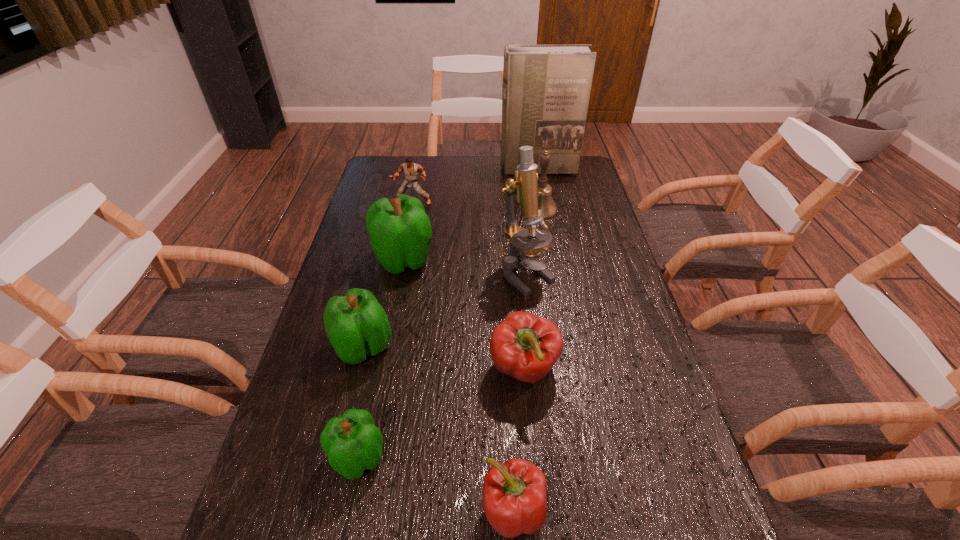
The image size is (960, 540). I want to click on object that is the fifth closest one to the bell, so [524, 346].

Choose which bell pepper is the third nearest neighbor to the nearest green bell pepper. Please provide its 2D coordinates. Your answer should be formatted as a tuple, i.e. [(x, y)], where the tuple contains the x and y coordinates of a point satisfying the conditions above.

[(524, 346)]

Point out which bell pepper is positioned as the nearest to the second smallest green bell pepper. Please provide its 2D coordinates. Your answer should be formatted as a tuple, i.e. [(x, y)], where the tuple contains the x and y coordinates of a point satisfying the conditions above.

[(352, 442)]

The height and width of the screenshot is (540, 960). Identify the location of the closest green bell pepper relative to the bigger pink bell pepper. (352, 442).

Identify the location of green bell pepper identified as the second closest to the farthest object. The width and height of the screenshot is (960, 540). 356,324.

At what (x,y) coordinates should I click in order to perform the action: click on blank area in the image that satisfies the following two spatial constraints: 1. on the back side of the nearest green bell pepper; 2. on the left side of the microscope. Please return your answer as a coordinate pair (x, y). This screenshot has width=960, height=540. Looking at the image, I should click on (396, 275).

Find the location of `free point that satisfies the following two spatial constraints: 1. on the back side of the microscope; 2. on the right side of the second smallest green bell pepper`. free point that satisfies the following two spatial constraints: 1. on the back side of the microscope; 2. on the right side of the second smallest green bell pepper is located at coordinates (380, 275).

Where is `blank space that satisfies the following two spatial constraints: 1. on the back side of the second farthest green bell pepper; 2. on the left side of the bell`? The width and height of the screenshot is (960, 540). blank space that satisfies the following two spatial constraints: 1. on the back side of the second farthest green bell pepper; 2. on the left side of the bell is located at coordinates (396, 210).

What are the coordinates of `vacant space that satisfies the following two spatial constraints: 1. on the back side of the microscope; 2. on the right side of the smallest green bell pepper` in the screenshot? It's located at (396, 275).